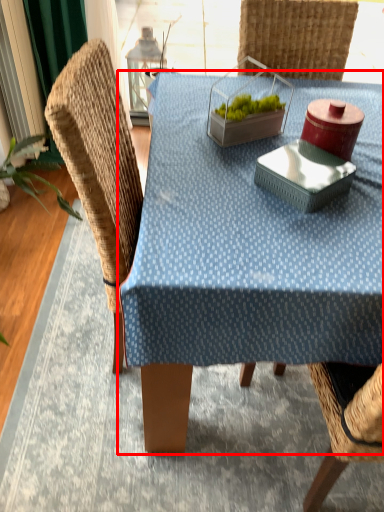
Question: Observing the image, what is the correct spatial positioning of table (annotated by the red box) in reference to swivel chair?

Choices:
 (A) left
 (B) right

Answer: (B)